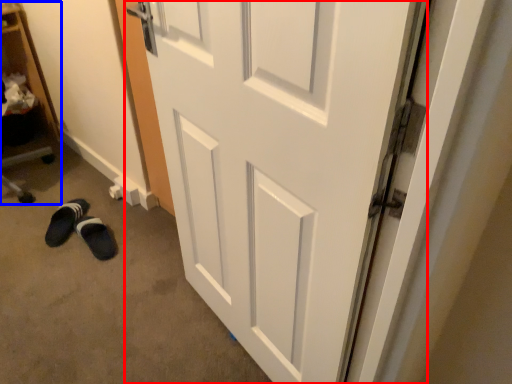
Question: Which object is closer to the camera taking this photo, door (highlighted by a red box) or bookshelf (highlighted by a blue box)?

Choices:
 (A) door
 (B) bookshelf

Answer: (A)